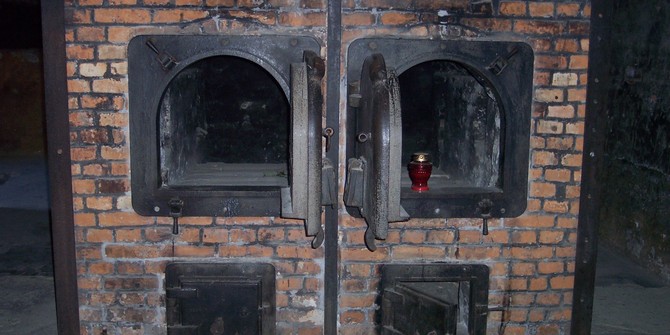
Where is `oven door`? The height and width of the screenshot is (335, 670). oven door is located at coordinates (314, 153), (381, 138).